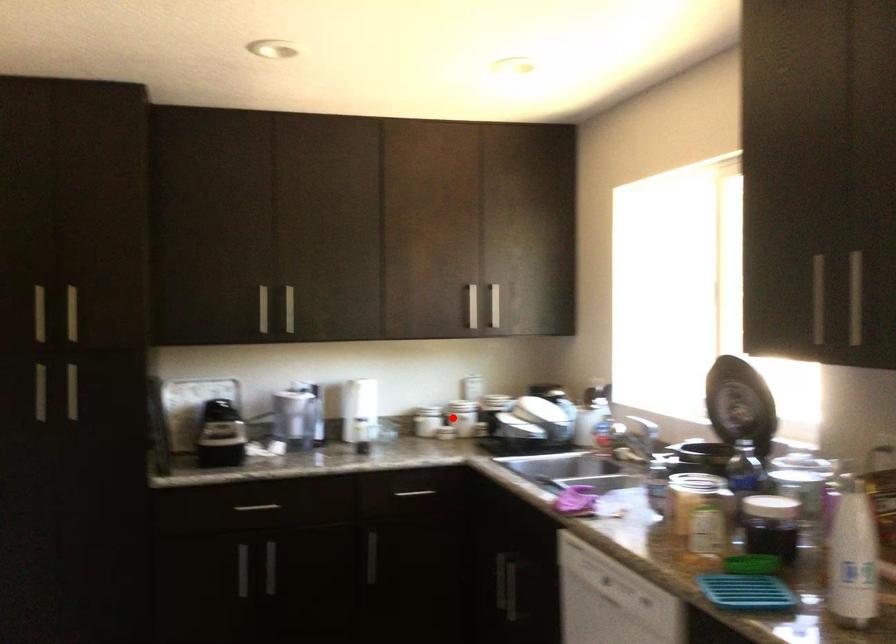
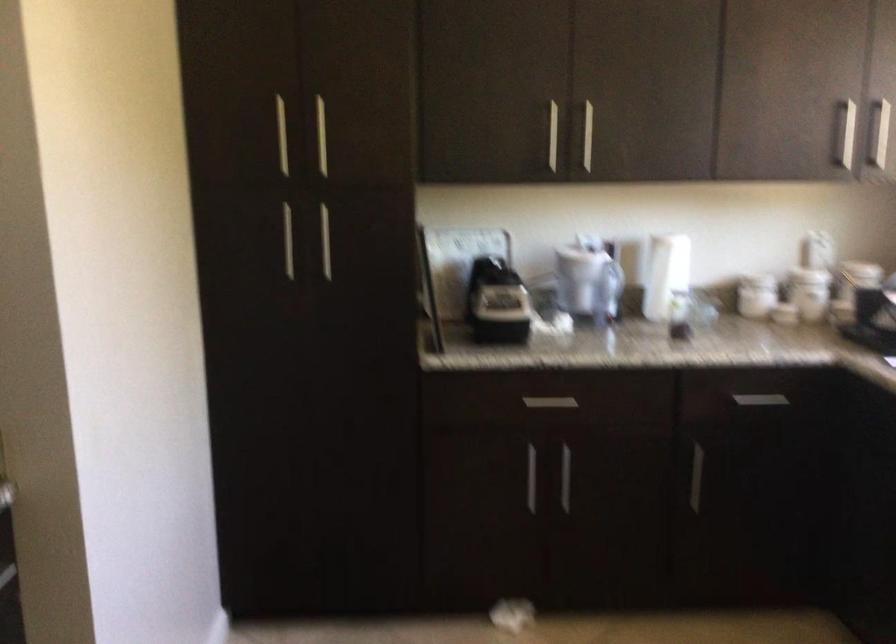
Find the pixel in the second image that matches the highlighted location in the first image.

(810, 292)